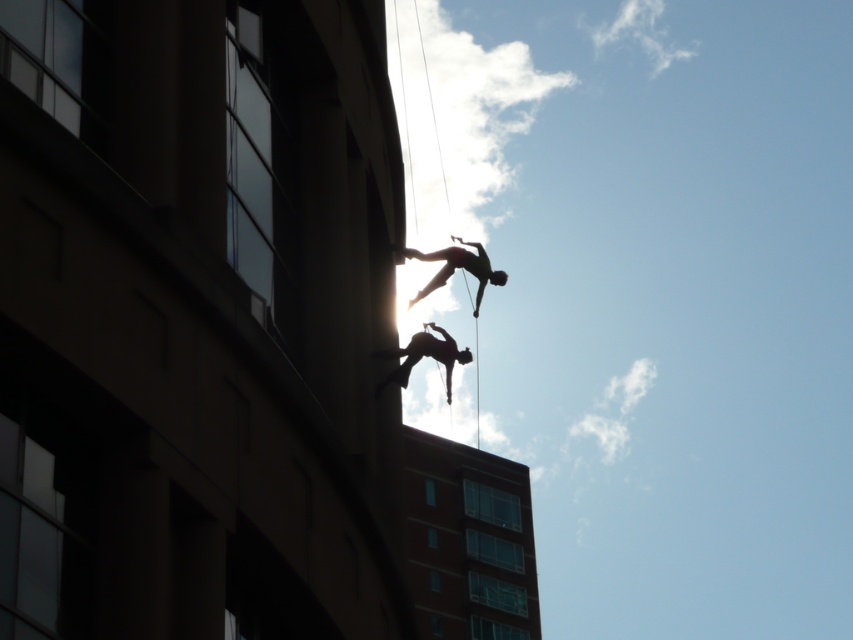
You are a safety inspector reviewing this image. You see the silhouette fabric climber at center and the silhouette fabric at upper center. Which object is positioned higher in the image?

The silhouette fabric at upper center is positioned higher than the silhouette fabric climber at center.

You are a safety inspector reviewing the image of two silhouette figures midair near a tall building. You notice the silhouette fabric climber at center and silhouette fabric at upper center. Which one is closer to the building?

The silhouette fabric climber at center is closer to the building because it is in front of the silhouette fabric at upper center.

You are a safety inspector assessing the scene. You notice two silhouette fabric elements in the image. Which one is shorter, the silhouette fabric climber at center or the silhouette fabric at upper center?

The silhouette fabric climber at center is shorter than the silhouette fabric at upper center.